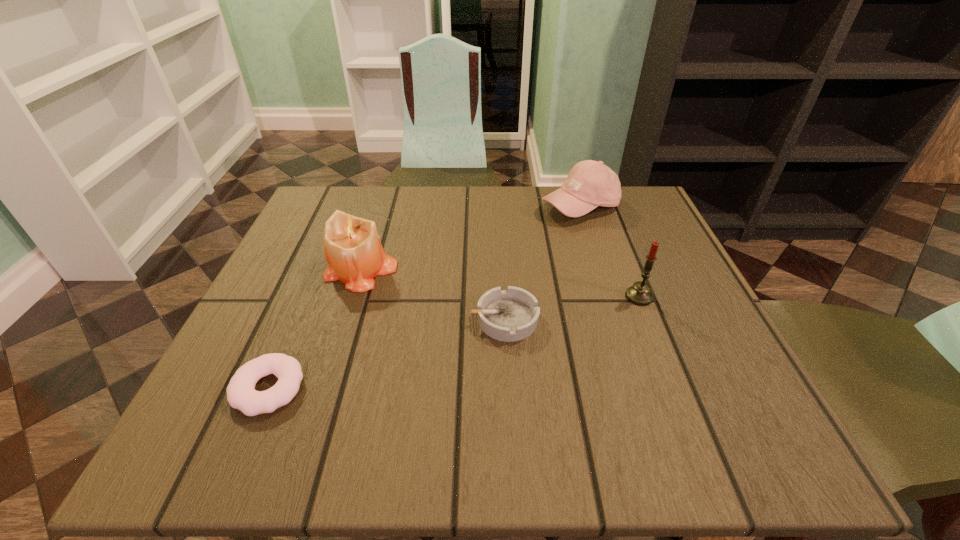
In order to click on free space that satisfies the following two spatial constraints: 1. on the back side of the nearest object; 2. on the left side of the right candle in this screenshot , I will do `click(308, 296)`.

Identify the location of free region that satisfies the following two spatial constraints: 1. on the front side of the right candle; 2. on the right side of the left candle. Image resolution: width=960 pixels, height=540 pixels. (352, 296).

Find the location of a particular element. free location that satisfies the following two spatial constraints: 1. on the back side of the doughnut; 2. on the right side of the right candle is located at coordinates (308, 296).